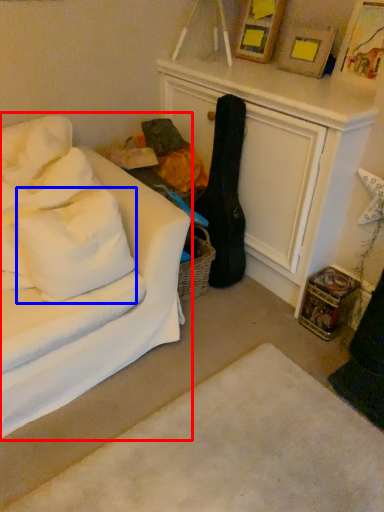
Question: Which object appears farthest to the camera in this image, studio couch (highlighted by a red box) or pillow (highlighted by a blue box)?

Choices:
 (A) studio couch
 (B) pillow

Answer: (B)